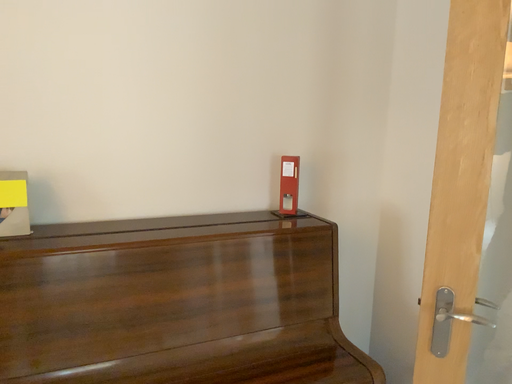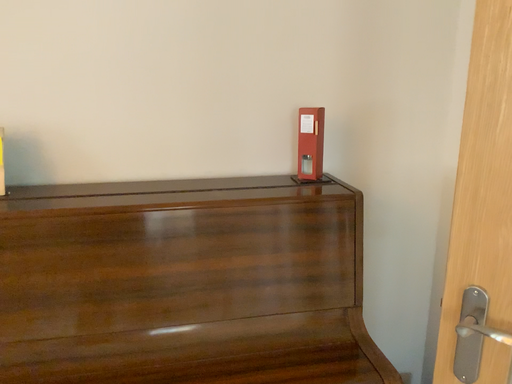
Question: How did the camera likely rotate when shooting the video?

Choices:
 (A) rotated right
 (B) rotated left

Answer: (B)